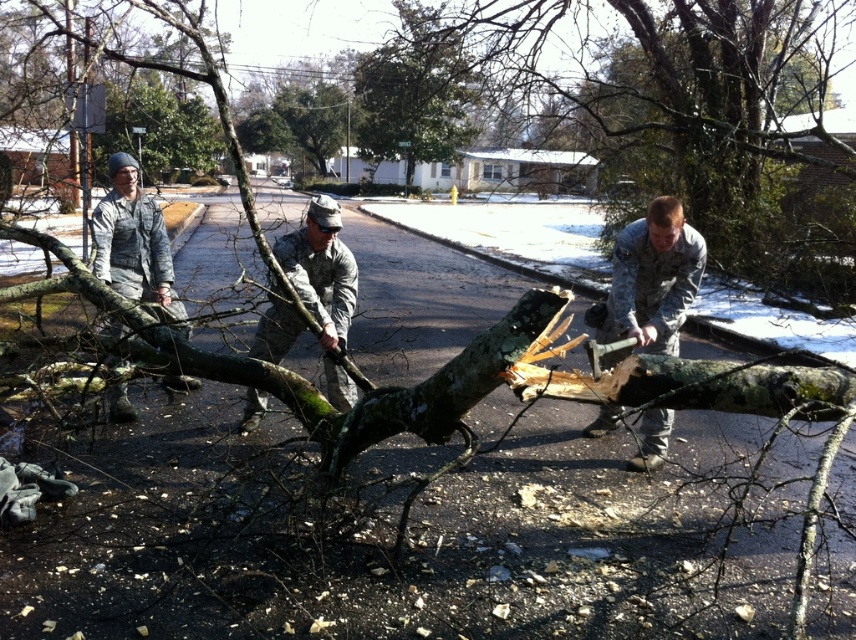
In the scene shown: You are a pedestrian trying to cross the road where the fallen tree is being cleared. Which camouflage uniform is closer to the edge of the road? The camouflage uniform at center or the camouflage uniform at left?

The camouflage uniform at left is closer to the edge of the road because the camouflage uniform at center is positioned to its right, meaning it is further away from the edge.

You are a drone operator trying to capture a clear aerial view of the two points on the fallen tree trunk. Which point, point (259, 416) or point (169, 294), is closer to the camera lens?

Point (259, 416) is closer to the viewer than point (169, 294), so the drone should focus on capturing that point first for clarity.

You are a pedestrian trying to cross the road where the fallen tree is being cleared. You see the green camouflage uniform at center and the camouflage uniform at left working on the tree. Which worker is closer to you as you approach the road?

The green camouflage uniform at center is closer to you because it is further to the viewer than the camouflage uniform at left, meaning it appears nearer in the scene.